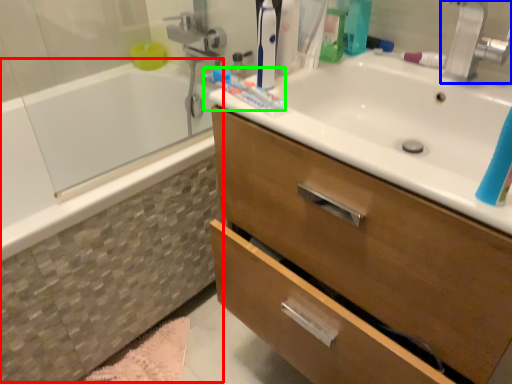
Question: Considering the real-world distances, which object is farthest from bath (highlighted by a red box)? tap (highlighted by a blue box) or toothpaste (highlighted by a green box)?

Choices:
 (A) tap
 (B) toothpaste

Answer: (A)